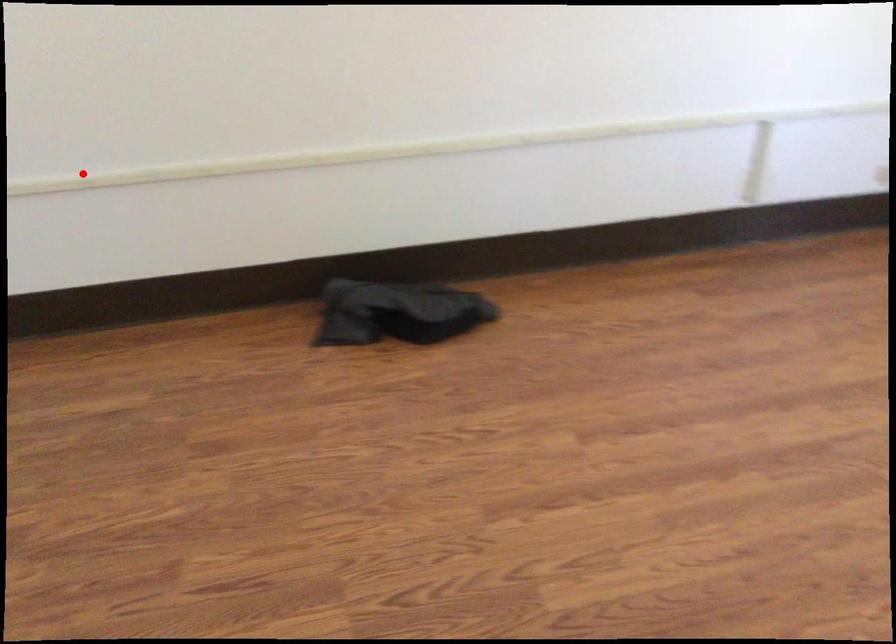
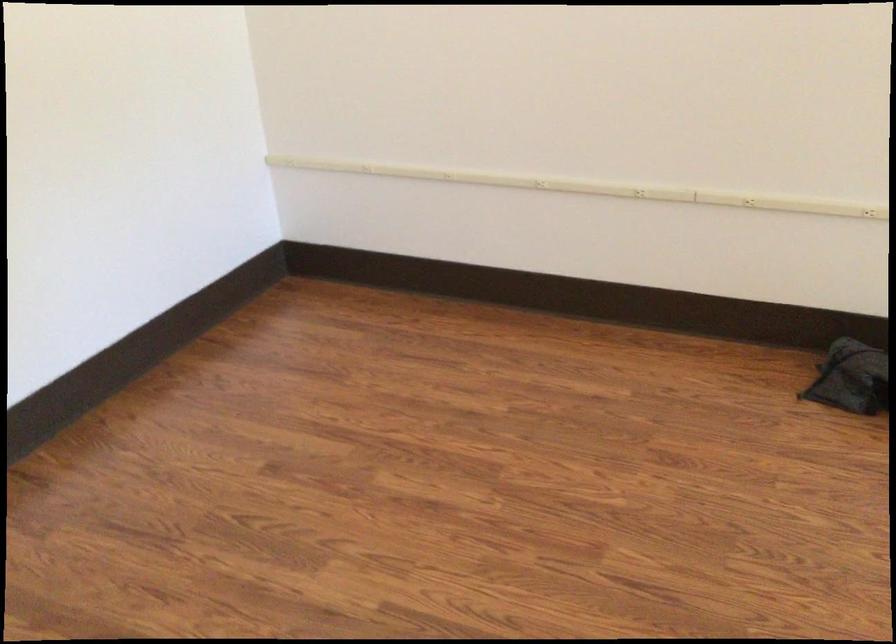
Find the pixel in the second image that matches the highlighted location in the first image.

(642, 182)